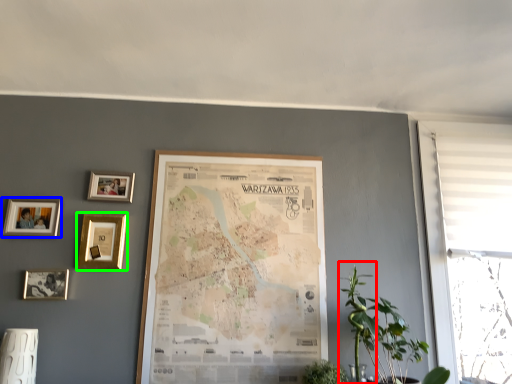
Question: Which is nearer to the plant (highlighted by a red box)? picture frame (highlighted by a blue box) or picture frame (highlighted by a green box).

Choices:
 (A) picture frame
 (B) picture frame

Answer: (B)